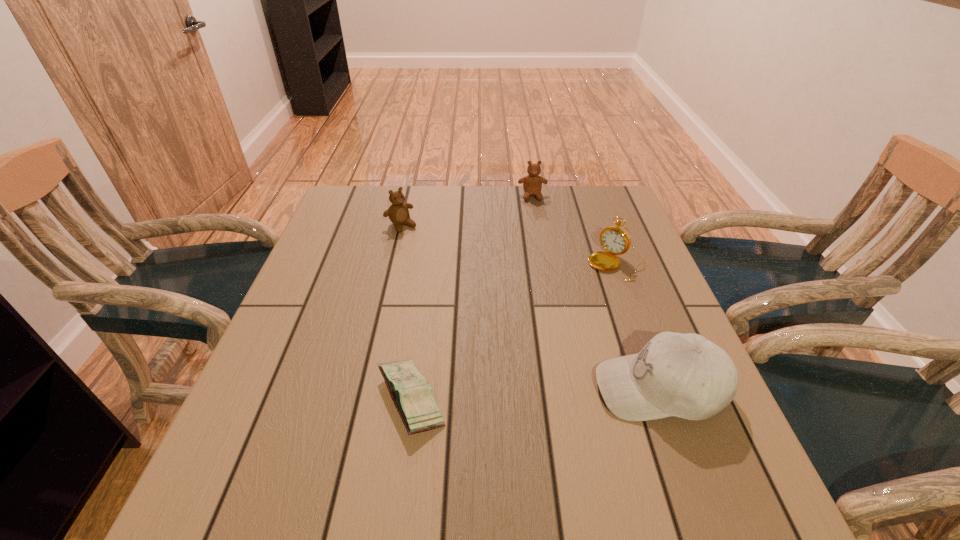
Where is `vacant space at the near left corner of the desktop`? The image size is (960, 540). vacant space at the near left corner of the desktop is located at coordinates (312, 449).

In the image, there is a desktop. Where is `free space at the far right corner`? The image size is (960, 540). free space at the far right corner is located at coordinates (581, 225).

Locate an element on the screen. vacant point located between the nearer teddy bear and the baseball cap is located at coordinates (530, 307).

Find the location of `empty location between the baseball cap and the pocket watch`. empty location between the baseball cap and the pocket watch is located at coordinates (638, 326).

The image size is (960, 540). I want to click on unoccupied area between the nearer teddy bear and the third nearest object, so click(509, 245).

This screenshot has width=960, height=540. I want to click on vacant region between the pocket watch and the baseball cap, so click(638, 326).

You are a GUI agent. You are given a task and a screenshot of the screen. Output one action in this format:
    pyautogui.click(x=<x>, y=<y>)
    Task: Click on the vacant area that lies between the baseball cap and the shortest object
    
    Given the screenshot: What is the action you would take?
    pyautogui.click(x=535, y=394)

Identify the location of vacant space that is in between the baseball cap and the shortest object. This screenshot has width=960, height=540. (535, 394).

Where is `vacant point located between the third nearest object and the baseball cap`? vacant point located between the third nearest object and the baseball cap is located at coordinates (638, 326).

Identify the location of vacant area that lies between the nearer teddy bear and the diary. (406, 313).